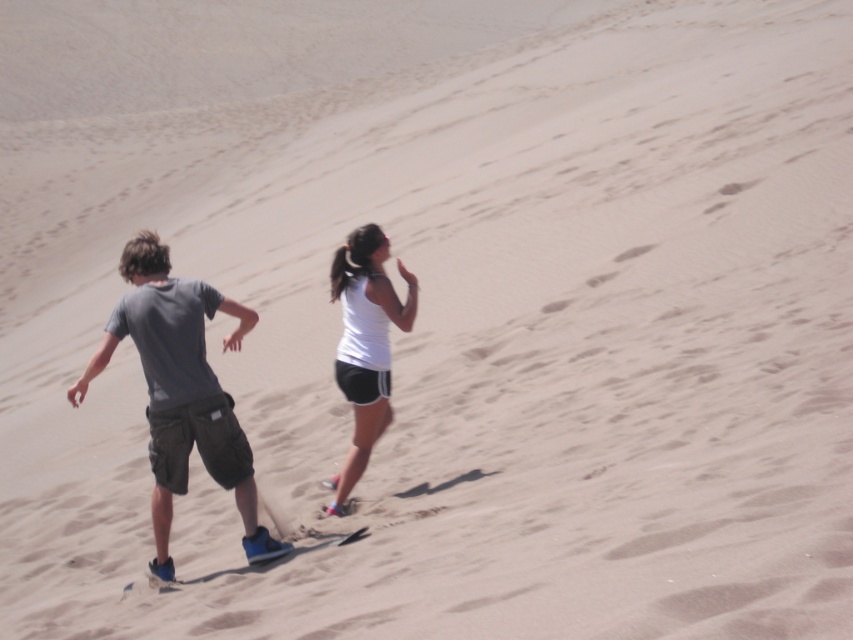
Question: Which object appears farthest from the camera in this image?

Choices:
 (A) gray cotton t-shirt at left
 (B) white matte tank top at center

Answer: (B)

Question: Which point is farther to the camera?

Choices:
 (A) white matte tank top at center
 (B) gray cotton t-shirt at left

Answer: (A)

Question: Does gray cotton t-shirt at left appear over white matte tank top at center?

Choices:
 (A) yes
 (B) no

Answer: (B)

Question: Can you confirm if gray cotton t-shirt at left is positioned to the right of white matte tank top at center?

Choices:
 (A) no
 (B) yes

Answer: (A)

Question: Observing the image, what is the correct spatial positioning of gray cotton t-shirt at left in reference to white matte tank top at center?

Choices:
 (A) right
 (B) left

Answer: (B)